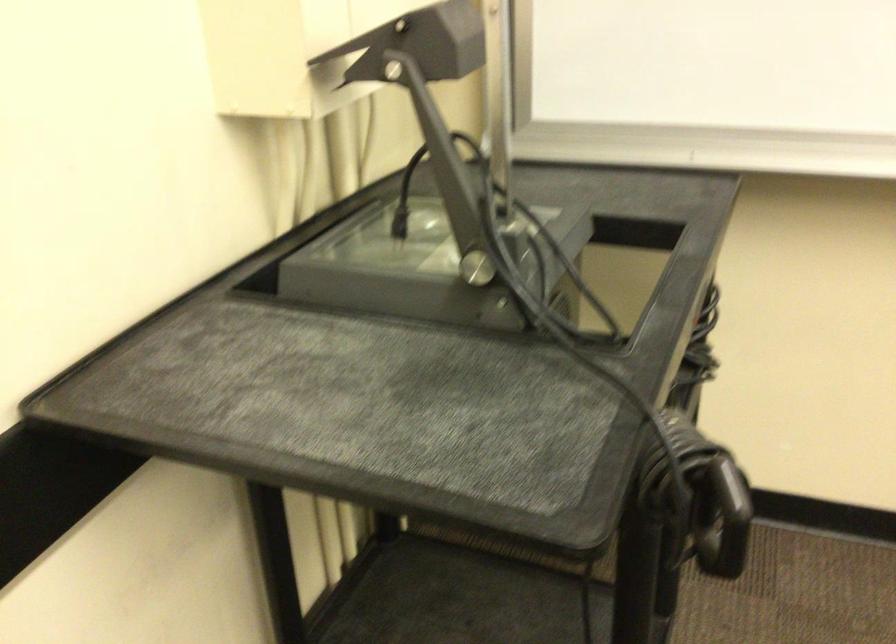
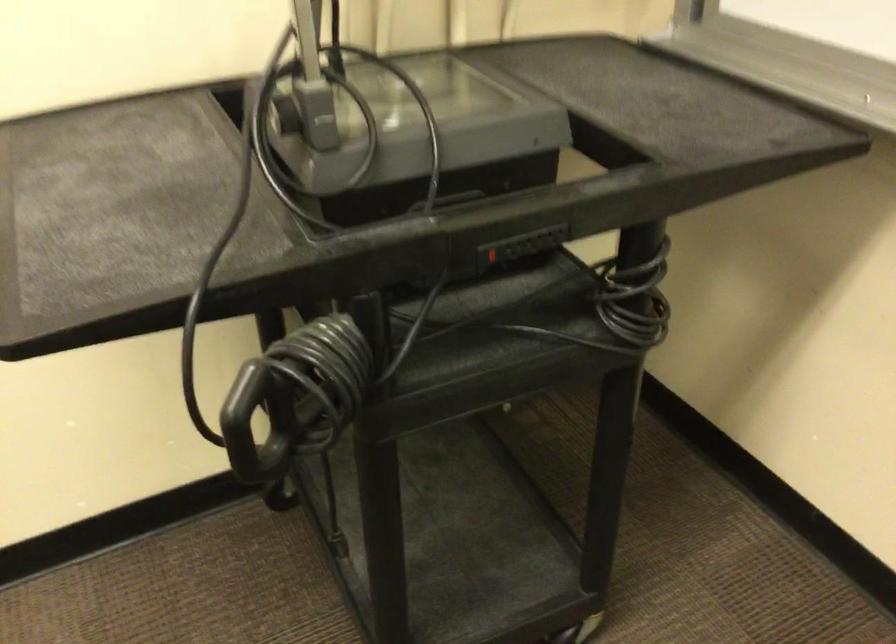
Find the pixel in the second image that matches pixel 696 324 in the first image.

(490, 254)